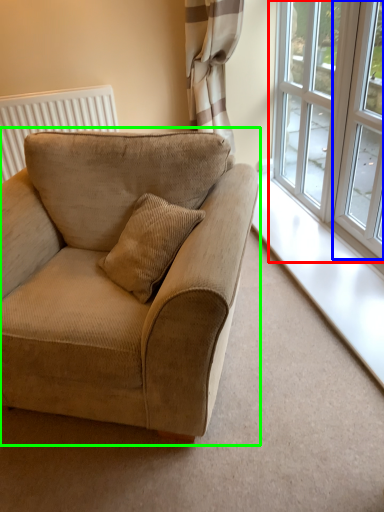
Question: Considering the real-world distances, which object is closest to window (highlighted by a red box)? window (highlighted by a blue box) or studio couch (highlighted by a green box).

Choices:
 (A) window
 (B) studio couch

Answer: (A)